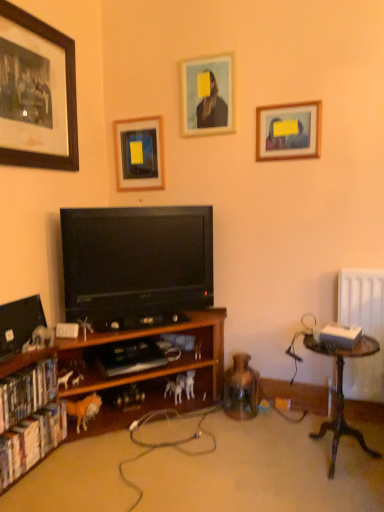
At what (x,y) coordinates should I click in order to perform the action: click on vacant area that is in front of orange plush horse at lower left, acting as the 2th animal starting from the back. Please return your answer as a coordinate pair (x, y). The width and height of the screenshot is (384, 512). Looking at the image, I should click on (75, 453).